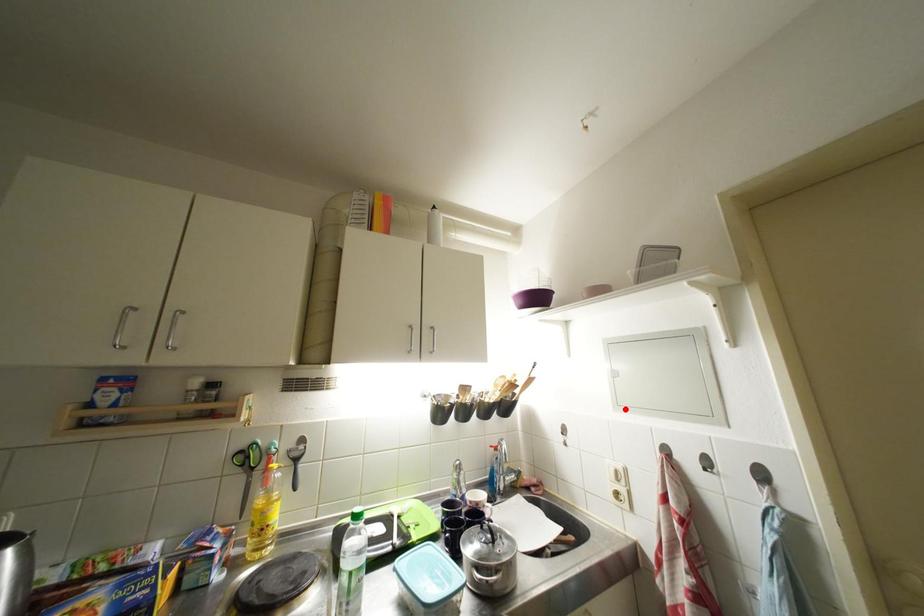
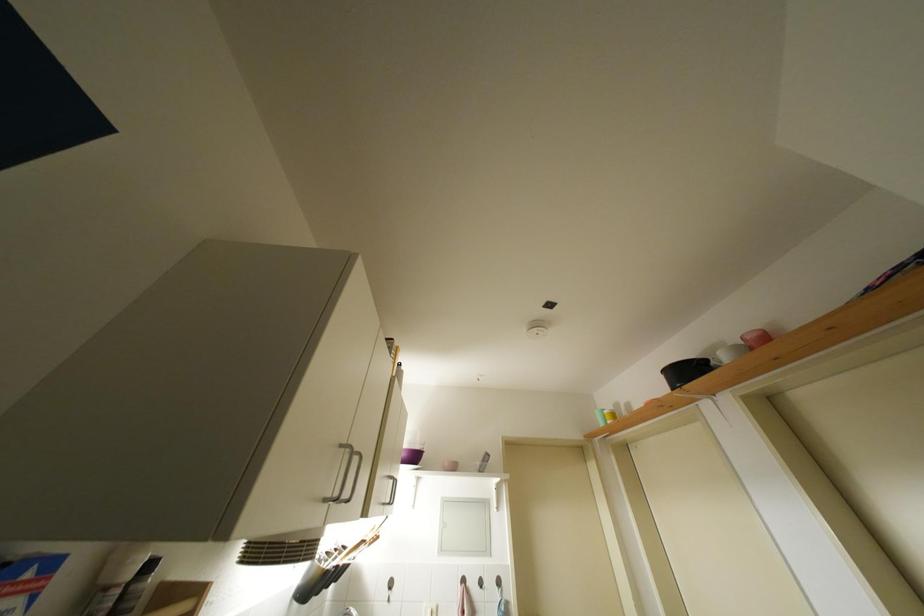
Question: I am providing you with two images of the same scene from different viewpoints. A red point is marked on the first image. Is the red point's position out of view in image 2?

Choices:
 (A) Yes
 (B) No

Answer: (B)